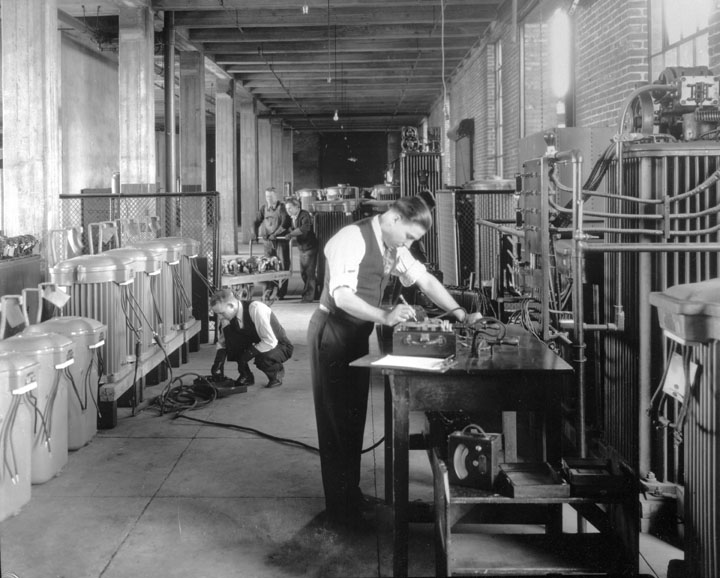
Where is `floor`? The height and width of the screenshot is (578, 720). floor is located at coordinates (184, 509).